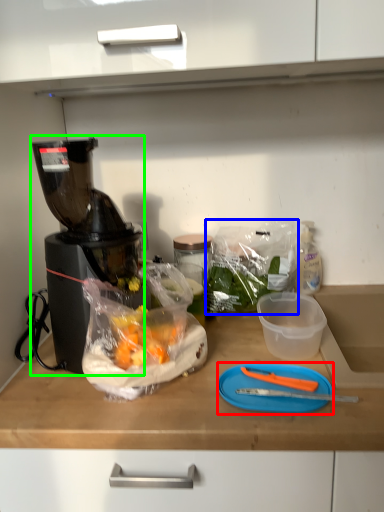
Question: Which object is the farthest from cutting board (highlighted by a red box)? Choose among these: plastic bag (highlighted by a blue box) or blender (highlighted by a green box).

Choices:
 (A) plastic bag
 (B) blender

Answer: (B)